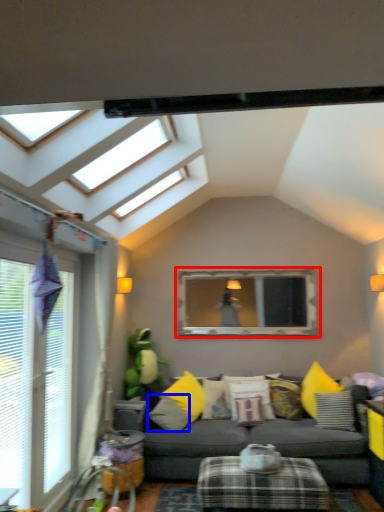
Question: Which object is closer to the camera taking this photo, bay window (highlighted by a red box) or pillow (highlighted by a blue box)?

Choices:
 (A) bay window
 (B) pillow

Answer: (B)